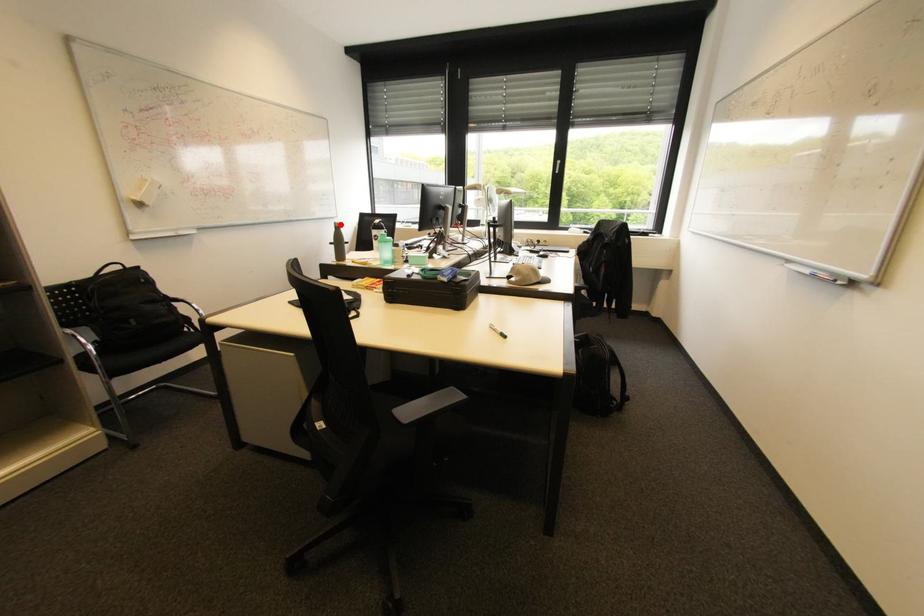
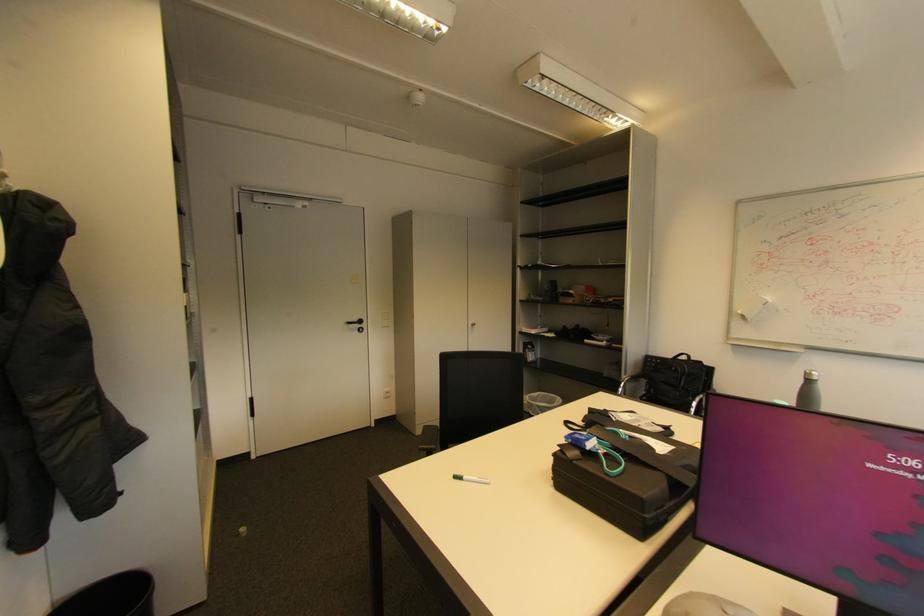
Question: A red point is marked in image1. In image2, is the corresponding 3D point closer to the camera or farther? Reply with the corresponding letter.

Choices:
 (A) The corresponding 3D point is closer.
 (B) The corresponding 3D point is farther.

Answer: (B)